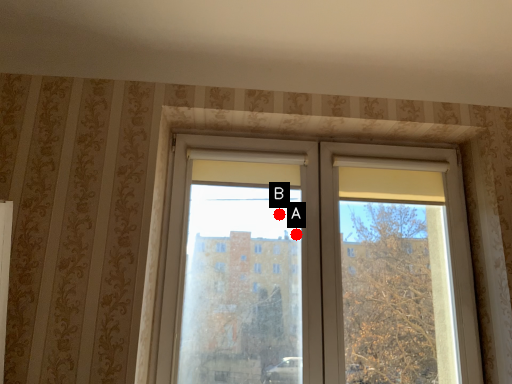
Question: Two points are circled on the image, labeled by A and B beside each circle. Which of the following is the closest to the observer?

Choices:
 (A) A is closer
 (B) B is closer

Answer: (A)